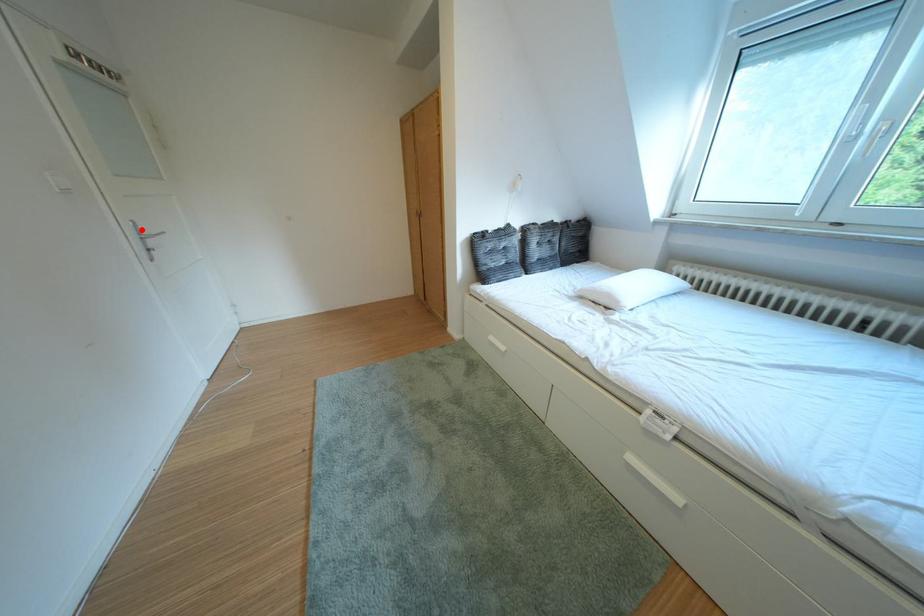
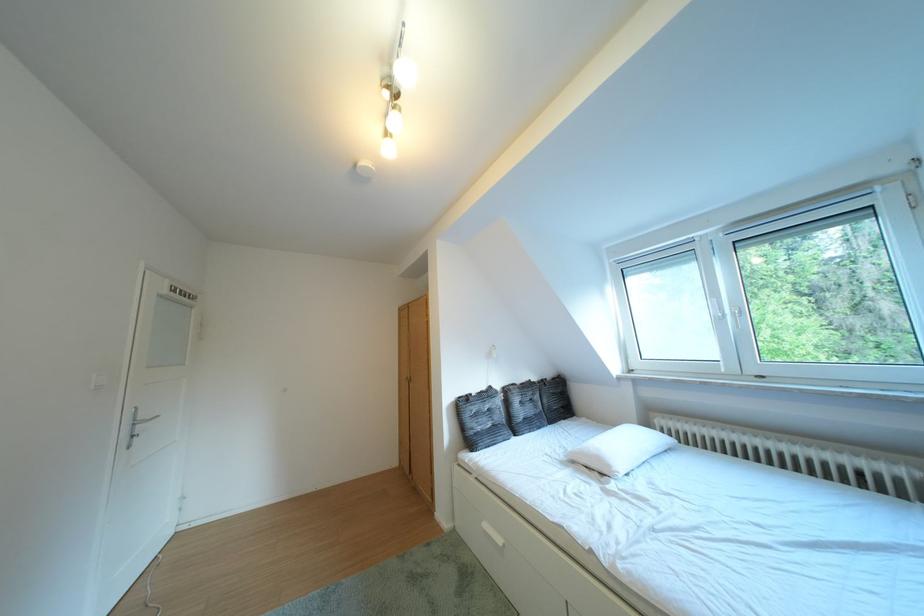
Question: I am providing you with two images of the same scene from different viewpoints. A red point is marked on the first image. Can you still see the location of the red point in image 2?

Choices:
 (A) Yes
 (B) No

Answer: (A)